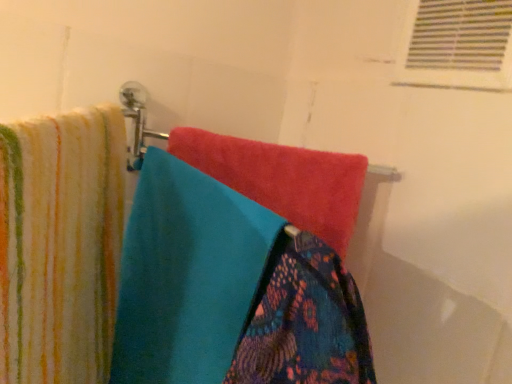
Describe the element at coordinates (305, 320) in the screenshot. I see `patterned fabric towel at center, which is the first towel in right-to-left order` at that location.

Locate an element on the screen. white plastic vent at upper right is located at coordinates (458, 46).

The width and height of the screenshot is (512, 384). Identify the location of patterned fabric towel at center, which is the third towel from left to right. (305, 320).

Between patterned fabric towel at center, which is the first towel in right-to-left order, and turquoise soft towel at center, the 2th towel from the left, which one has larger width?

With larger width is turquoise soft towel at center, the 2th towel from the left.

How distant is patterned fabric towel at center, which is the third towel from left to right, from turquoise soft towel at center, the 2th towel from the left?

patterned fabric towel at center, which is the third towel from left to right, and turquoise soft towel at center, the 2th towel from the left, are 5.54 inches apart from each other.

From a real-world perspective, who is located higher, patterned fabric towel at center, which is the first towel in right-to-left order, or turquoise soft towel at center, the 2th towel from the left?

patterned fabric towel at center, which is the first towel in right-to-left order.

Would you consider patterned fabric towel at center, which is the first towel in right-to-left order, to be distant from turquoise soft towel at center, positioned as the 2th towel in right-to-left order?

That's not correct — patterned fabric towel at center, which is the first towel in right-to-left order, is a little close to turquoise soft towel at center, positioned as the 2th towel in right-to-left order.

In terms of width, does white plastic vent at upper right look wider or thinner when compared to turquoise soft towel at center, positioned as the 2th towel in right-to-left order?

white plastic vent at upper right is thinner than turquoise soft towel at center, positioned as the 2th towel in right-to-left order.

Is white plastic vent at upper right turned away from turquoise soft towel at center, the 2th towel from the left?

That's not correct — white plastic vent at upper right is not looking away from turquoise soft towel at center, the 2th towel from the left.

Consider the image. Is white plastic vent at upper right bigger or smaller than turquoise soft towel at center, positioned as the 2th towel in right-to-left order?

In the image, white plastic vent at upper right appears to be smaller than turquoise soft towel at center, positioned as the 2th towel in right-to-left order.

From the image's perspective, relative to white plastic vent at upper right, is turquoise soft towel at center, the 2th towel from the left, above or below?

From the image's perspective, turquoise soft towel at center, the 2th towel from the left, appears below white plastic vent at upper right.

Is turquoise soft towel at center, the 2th towel from the left, to the left or to the right of white plastic vent at upper right in the image?

turquoise soft towel at center, the 2th towel from the left, is to the left of white plastic vent at upper right.

Is turquoise soft towel at center, the 2th towel from the left, oriented towards white plastic vent at upper right?

No, turquoise soft towel at center, the 2th towel from the left, is not oriented towards white plastic vent at upper right.

How far apart are patterned fabric towel at center, which is the third towel from left to right, and striped cotton towel at left, marked as the third towel in a right-to-left arrangement?

8.92 inches.

What's the angular difference between patterned fabric towel at center, which is the first towel in right-to-left order, and striped cotton towel at left, which is the 1th towel from left to right,'s facing directions?

42 degrees.

Can you confirm if patterned fabric towel at center, which is the third towel from left to right, is shorter than striped cotton towel at left, marked as the third towel in a right-to-left arrangement?

Indeed, patterned fabric towel at center, which is the third towel from left to right, has a lesser height compared to striped cotton towel at left, marked as the third towel in a right-to-left arrangement.

Considering the points (326, 340) and (58, 335), which point is behind, point (326, 340) or point (58, 335)?

The point (58, 335) is more distant.

Is the depth of patterned fabric towel at center, which is the first towel in right-to-left order, greater than that of white plastic vent at upper right?

No, it is not.

Would you consider patterned fabric towel at center, which is the first towel in right-to-left order, to be distant from white plastic vent at upper right?

patterned fabric towel at center, which is the first towel in right-to-left order, is actually quite close to white plastic vent at upper right.

Considering the positions of points (321, 263) and (430, 32), is point (321, 263) closer to camera compared to point (430, 32)?

Yes.

Is patterned fabric towel at center, which is the third towel from left to right, taller than white plastic vent at upper right?

In fact, patterned fabric towel at center, which is the third towel from left to right, may be shorter than white plastic vent at upper right.

Which is more to the left, striped cotton towel at left, marked as the third towel in a right-to-left arrangement, or patterned fabric towel at center, which is the third towel from left to right?

Positioned to the left is striped cotton towel at left, marked as the third towel in a right-to-left arrangement.

Is point (84, 111) less distant than point (333, 273)?

No, it is not.

Between point (99, 244) and point (424, 57), which one is positioned behind?

Point (424, 57)

Which is in front, striped cotton towel at left, which is the 1th towel from left to right, or white plastic vent at upper right?

striped cotton towel at left, which is the 1th towel from left to right.

You are a GUI agent. You are given a task and a screenshot of the screen. Output one action in this format:
    pyautogui.click(x=<x>, y=<y>)
    Task: Click on the shutter located behind the striped cotton towel at left, which is the 1th towel from left to right
    
    Given the screenshot: What is the action you would take?
    pyautogui.click(x=458, y=46)

Could you measure the distance between striped cotton towel at left, marked as the third towel in a right-to-left arrangement, and white plastic vent at upper right?

striped cotton towel at left, marked as the third towel in a right-to-left arrangement, is 19.90 inches from white plastic vent at upper right.

From a real-world perspective, starting from the turquoise soft towel at center, the 2th towel from the left, which towel is the 2nd one vertically above it? Please provide its 2D coordinates.

[(305, 320)]

Where is `the 1st towel in front when counting from the white plastic vent at upper right`? the 1st towel in front when counting from the white plastic vent at upper right is located at coordinates click(x=188, y=275).

Looking at the image, which one is located further to white plastic vent at upper right, patterned fabric towel at center, which is the first towel in right-to-left order, or turquoise soft towel at center, positioned as the 2th towel in right-to-left order?

turquoise soft towel at center, positioned as the 2th towel in right-to-left order, is positioned further to the anchor white plastic vent at upper right.

Which object lies further to the anchor point patterned fabric towel at center, which is the first towel in right-to-left order, turquoise soft towel at center, the 2th towel from the left, or striped cotton towel at left, which is the 1th towel from left to right?

striped cotton towel at left, which is the 1th towel from left to right, lies further to patterned fabric towel at center, which is the first towel in right-to-left order, than the other object.

Which object lies nearer to the anchor point striped cotton towel at left, which is the 1th towel from left to right, turquoise soft towel at center, positioned as the 2th towel in right-to-left order, or patterned fabric towel at center, which is the third towel from left to right?

turquoise soft towel at center, positioned as the 2th towel in right-to-left order.

Looking at the image, which one is located further to turquoise soft towel at center, the 2th towel from the left, striped cotton towel at left, marked as the third towel in a right-to-left arrangement, or patterned fabric towel at center, which is the third towel from left to right?

The object further to turquoise soft towel at center, the 2th towel from the left, is patterned fabric towel at center, which is the third towel from left to right.

When comparing their distances from patterned fabric towel at center, which is the first towel in right-to-left order, does striped cotton towel at left, which is the 1th towel from left to right, or white plastic vent at upper right seem further?

white plastic vent at upper right.

Looking at the image, which one is located further to patterned fabric towel at center, which is the third towel from left to right, turquoise soft towel at center, the 2th towel from the left, or white plastic vent at upper right?

Among the two, white plastic vent at upper right is located further to patterned fabric towel at center, which is the third towel from left to right.

When comparing their distances from patterned fabric towel at center, which is the third towel from left to right, does striped cotton towel at left, marked as the third towel in a right-to-left arrangement, or turquoise soft towel at center, positioned as the 2th towel in right-to-left order, seem closer?

turquoise soft towel at center, positioned as the 2th towel in right-to-left order, is closer to patterned fabric towel at center, which is the third towel from left to right.

When comparing their distances from white plastic vent at upper right, does turquoise soft towel at center, positioned as the 2th towel in right-to-left order, or patterned fabric towel at center, which is the third towel from left to right, seem closer?

The object closer to white plastic vent at upper right is patterned fabric towel at center, which is the third towel from left to right.

At what (x,y) coordinates should I click in order to perform the action: click on towel situated between striped cotton towel at left, marked as the third towel in a right-to-left arrangement, and patterned fabric towel at center, which is the first towel in right-to-left order, from left to right. Please return your answer as a coordinate pair (x, y). The height and width of the screenshot is (384, 512). Looking at the image, I should click on (188, 275).